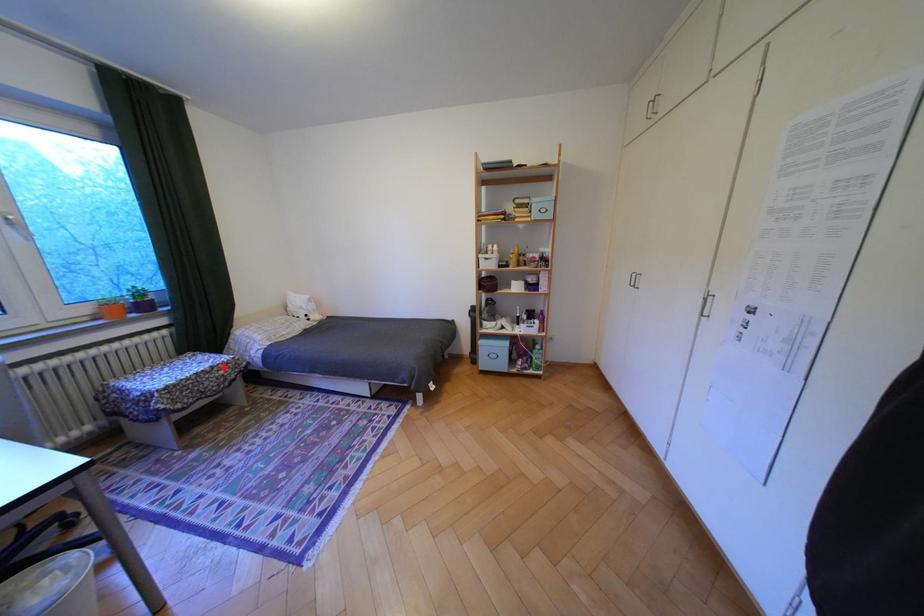
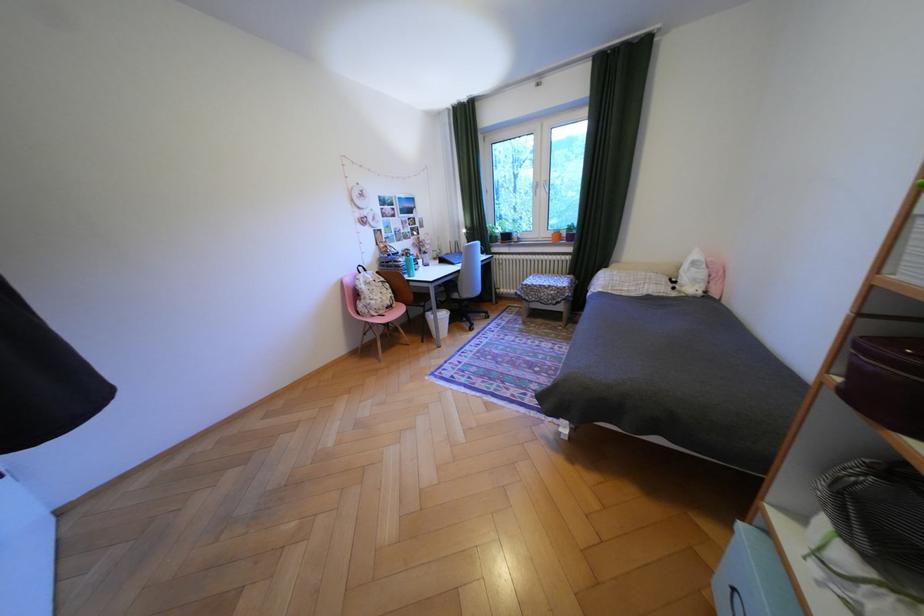
The point at the highlighted location is marked in the first image. Where is the corresponding point in the second image?

(562, 286)